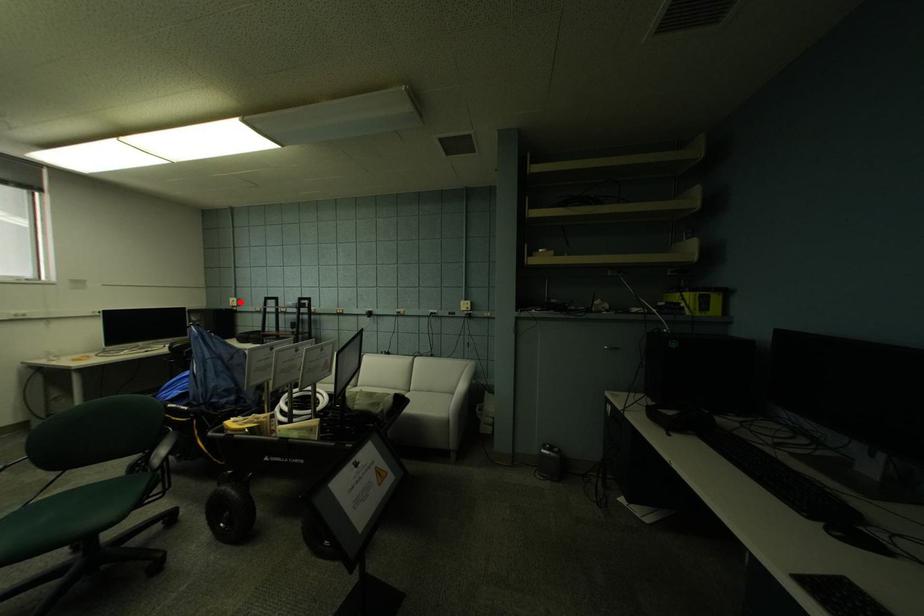
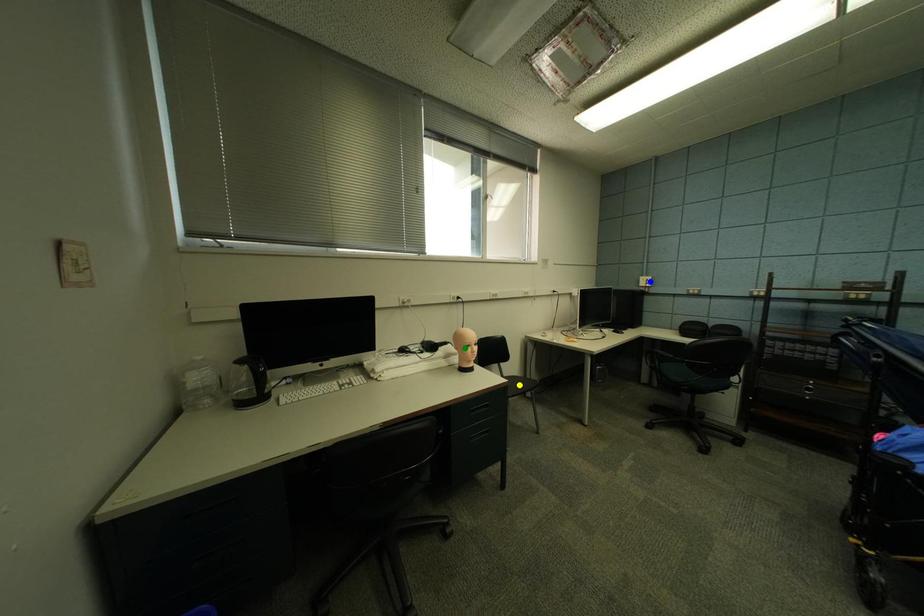
Question: I am providing you with two images of the same scene from different viewpoints. A red point is marked on the first image. You are given multiple points on the second image. Which point in image 2 represents the same 3d spot as the red point in image 1?

Choices:
 (A) blue point
 (B) green point
 (C) yellow point

Answer: (A)